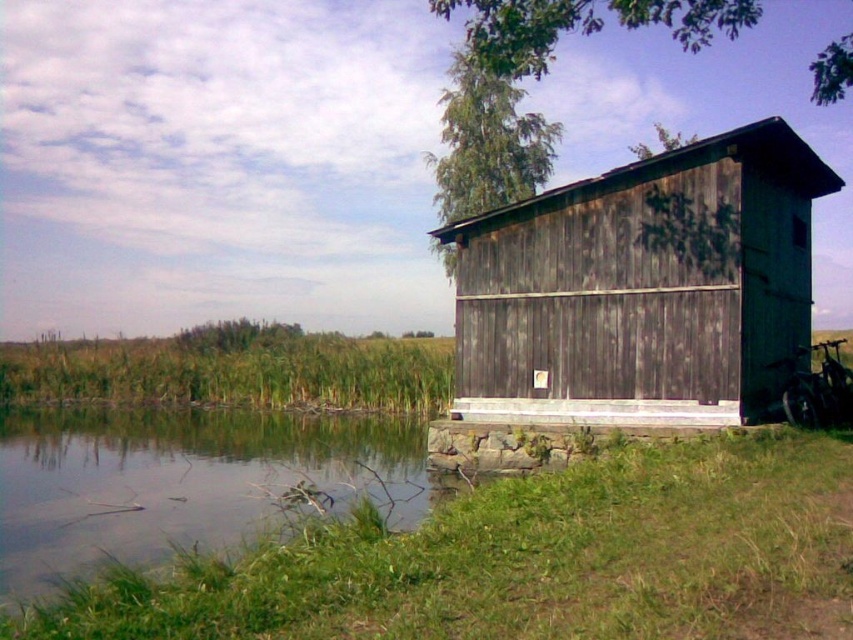
You are a delivery person needing to place a package on the ground between the weathered wood hut at right and the clear water at lower left. The package requires a space of 8 meters. Is there enough space between them to place the package?

The distance between the weathered wood hut at right and the clear water at lower left is 7.81 meters, which is slightly less than the required 8 meters. Therefore, there isn not enough space to place the package between them.

You are standing at the edge of the pond and want to walk to the weathered wood hut at right. Which direction should you go to avoid stepping into the clear water at lower left?

To avoid stepping into the clear water at lower left, you should walk towards the weathered wood hut at right by moving away from the clear water at lower left since the hut is closer to you than the water.